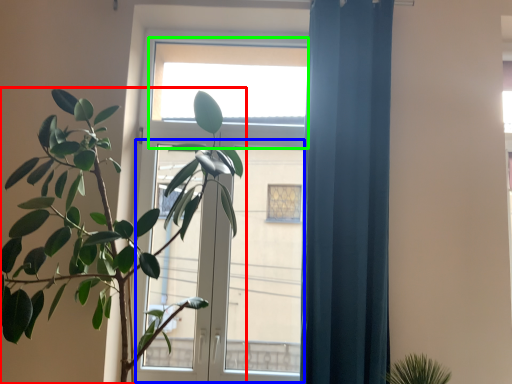
Question: Considering the real-world distances, which object is closest to houseplant (highlighted by a red box)? screen door (highlighted by a blue box) or window (highlighted by a green box).

Choices:
 (A) screen door
 (B) window

Answer: (B)